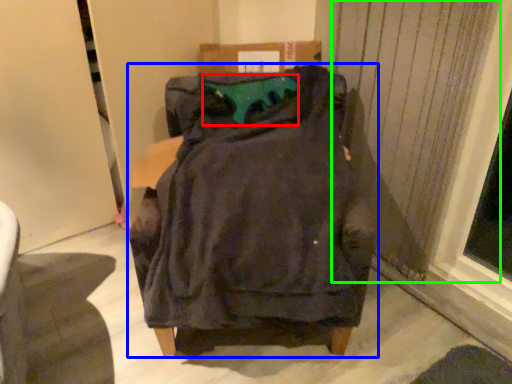
Question: Which is nearer to the teal (highlighted by a red box)? furniture (highlighted by a blue box) or curtain (highlighted by a green box).

Choices:
 (A) furniture
 (B) curtain

Answer: (A)